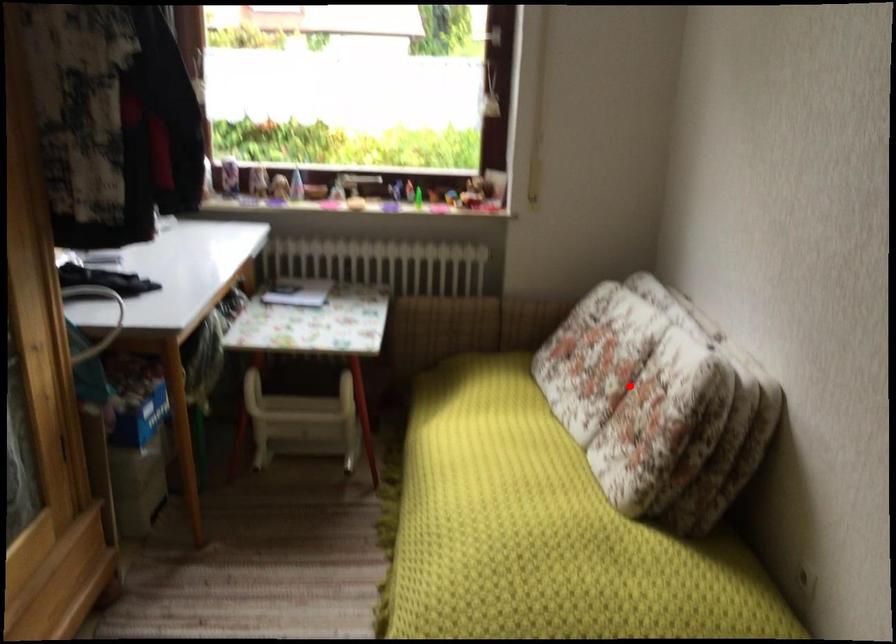
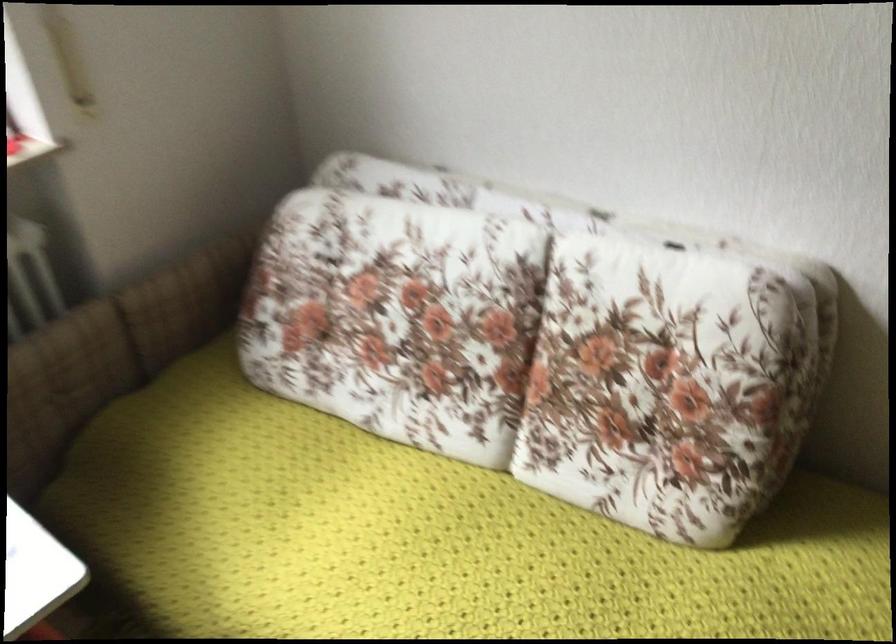
Question: I am providing you with two images of the same scene from different viewpoints. Given a red point in image1, look at the same physical point in image2. Is it:

Choices:
 (A) Closer to the viewpoint
 (B) Farther from the viewpoint

Answer: (A)